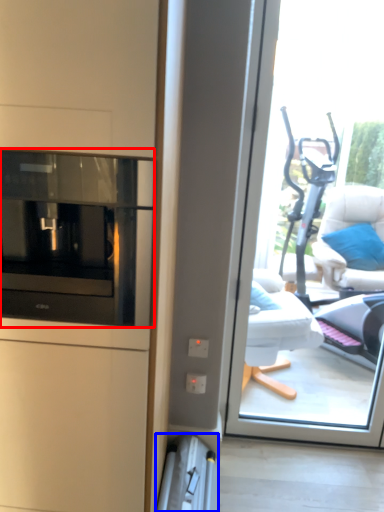
Question: Which of the following is the closest to the observer, home appliance (highlighted by a red box) or appliance (highlighted by a blue box)?

Choices:
 (A) home appliance
 (B) appliance

Answer: (A)